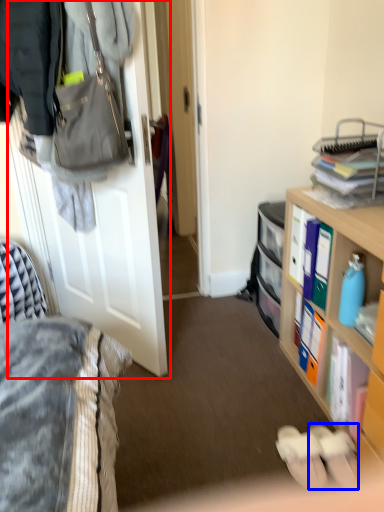
Question: Which of the following is the farthest to the observer, door (highlighted by a red box) or footwear (highlighted by a blue box)?

Choices:
 (A) door
 (B) footwear

Answer: (B)